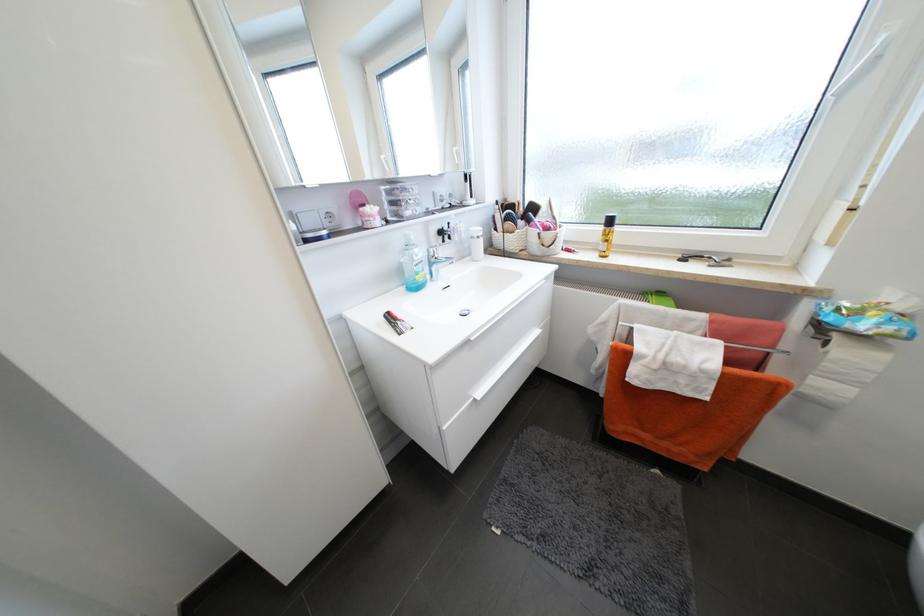
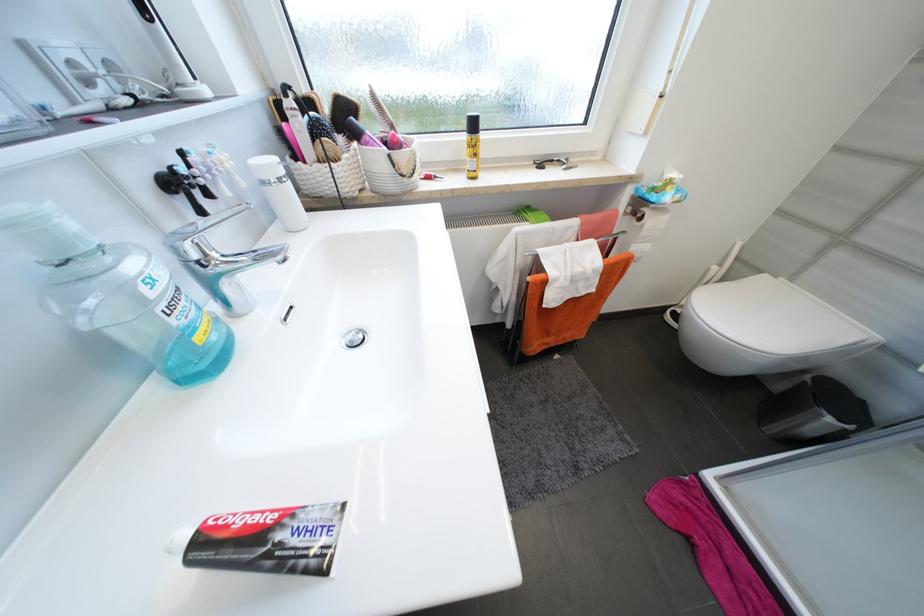
The point at (502, 230) is marked in the first image. Where is the corresponding point in the second image?

(304, 158)